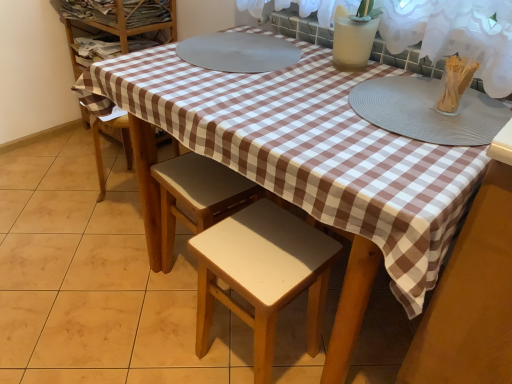
The image size is (512, 384). I want to click on unoccupied region to the right of clear plastic container at upper right, so click(483, 111).